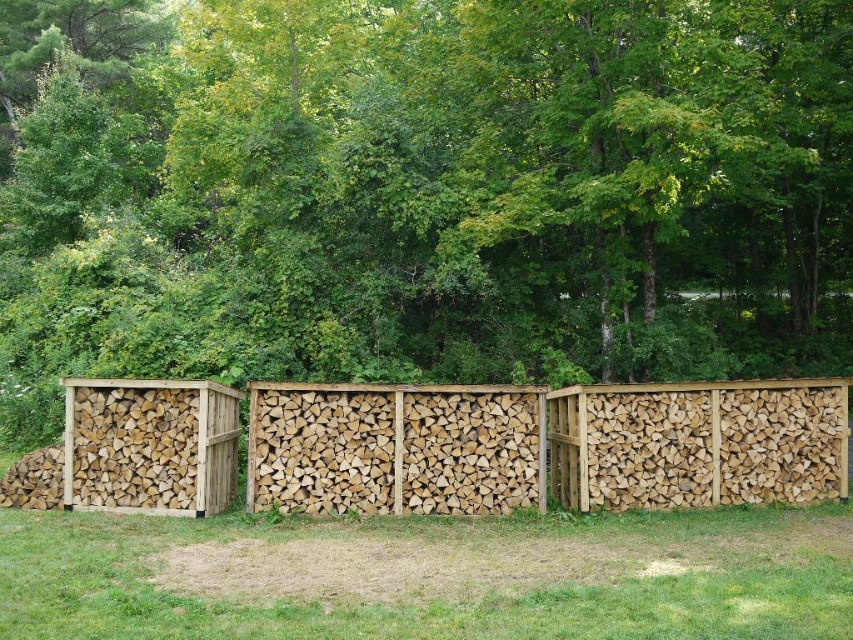
You are standing in the outdoor scene and want to walk towards the natural wood fence at center. Which direction should you move relative to the green grass at lower center?

Since the green grass at lower center is in front of the natural wood fence at center, you should move forward from the green grass at lower center to reach the natural wood fence at center.

You are standing in the outdoor scene and want to place a small birdhouse between the natural green leaves at center and the natural wood fence at center. Based on their positions, where should you place the birdhouse?

The natural green leaves at center are above the natural wood fence at center, so you should place the birdhouse between them by positioning it below the natural green leaves at center and above the natural wood fence at center.

You are a gardener who wants to place a 3.5 meter long decorative fence panel between the green grass at lower center and the natural wood fence at center. Will the panel fit in the space between them?

The distance between the green grass at lower center and the natural wood fence at center is 3.68 meters. Since the decorative fence panel is 3.5 meters long, it will fit in the space between them with approximately 0.18 meters of extra space remaining.